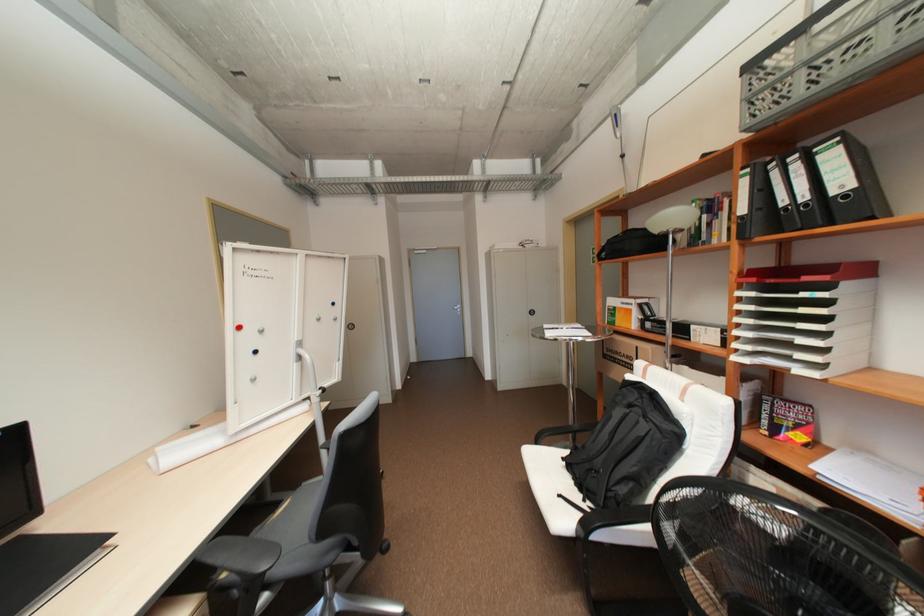
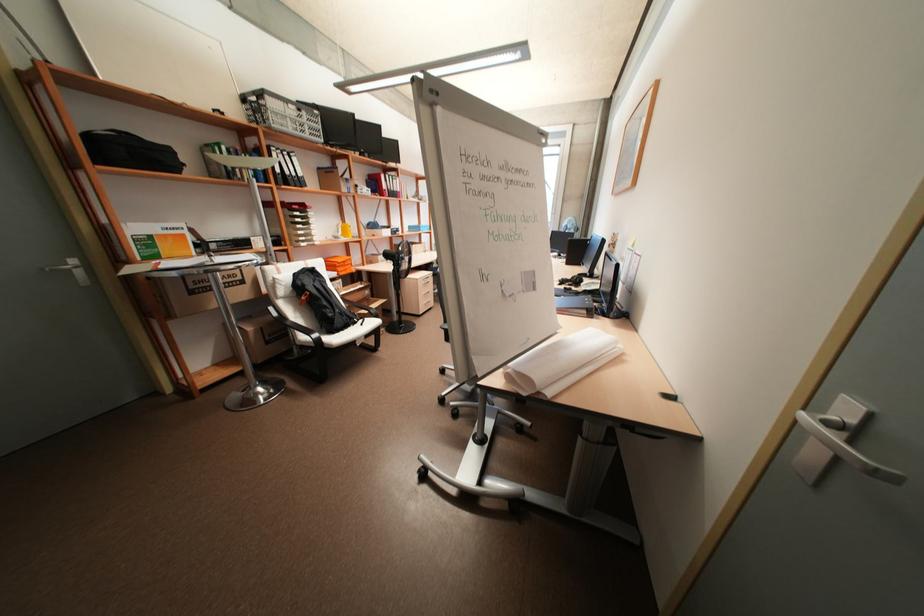
Where in the second image is the point corresponding to the point at 801,166 from the first image?

(293, 158)